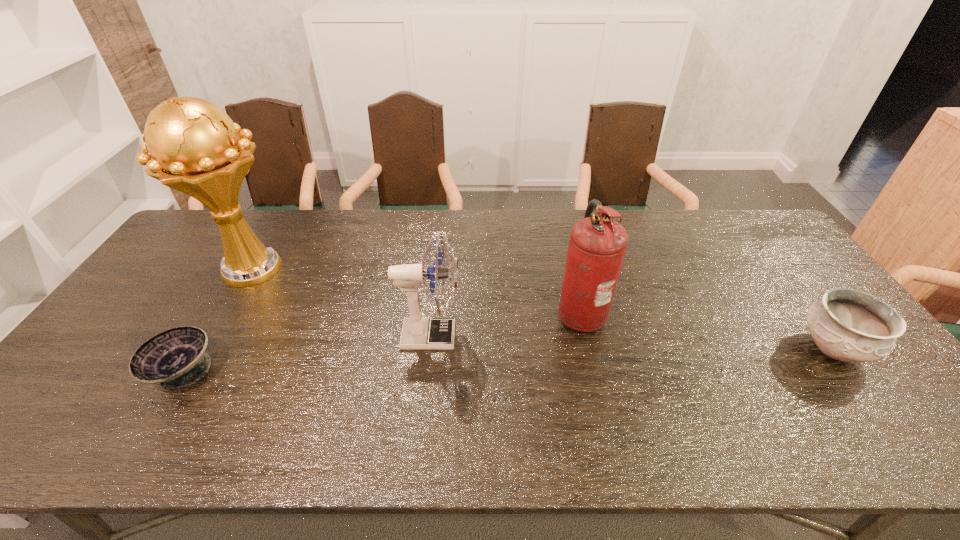
Find the location of a particular element. free point located 0.240m at the front of the fourth object from left to right where the nozzle is aimed is located at coordinates (471, 312).

The width and height of the screenshot is (960, 540). What are the coordinates of `free space located 0.130m at the front of the fourth object from left to right where the nozzle is aimed` in the screenshot? It's located at (511, 312).

At what (x,y) coordinates should I click in order to perform the action: click on free space located 0.090m on the front-facing side of the third object from right to left. Please return your answer as a coordinate pair (x, y). This screenshot has height=540, width=960. Looking at the image, I should click on (494, 336).

Where is `vacant space located on the back of the pottery`? This screenshot has height=540, width=960. vacant space located on the back of the pottery is located at coordinates [761, 254].

You are a GUI agent. You are given a task and a screenshot of the screen. Output one action in this format:
    pyautogui.click(x=<x>, y=<y>)
    Task: Click on the free spot located 0.170m on the back of the bowl
    
    Given the screenshot: What is the action you would take?
    pyautogui.click(x=226, y=300)

The image size is (960, 540). In order to click on object situated at the far edge in this screenshot , I will do `click(195, 146)`.

Locate an element on the screen. The image size is (960, 540). object located at the left edge is located at coordinates point(195,146).

This screenshot has width=960, height=540. Find the location of `object at the right edge`. object at the right edge is located at coordinates (846, 325).

You are a GUI agent. You are given a task and a screenshot of the screen. Output one action in this format:
    pyautogui.click(x=<x>, y=<y>)
    Task: Click on the object that is at the far left corner
    
    Given the screenshot: What is the action you would take?
    pyautogui.click(x=195, y=146)

This screenshot has height=540, width=960. In order to click on vacant position at the far edge of the desktop in this screenshot , I will do `click(383, 251)`.